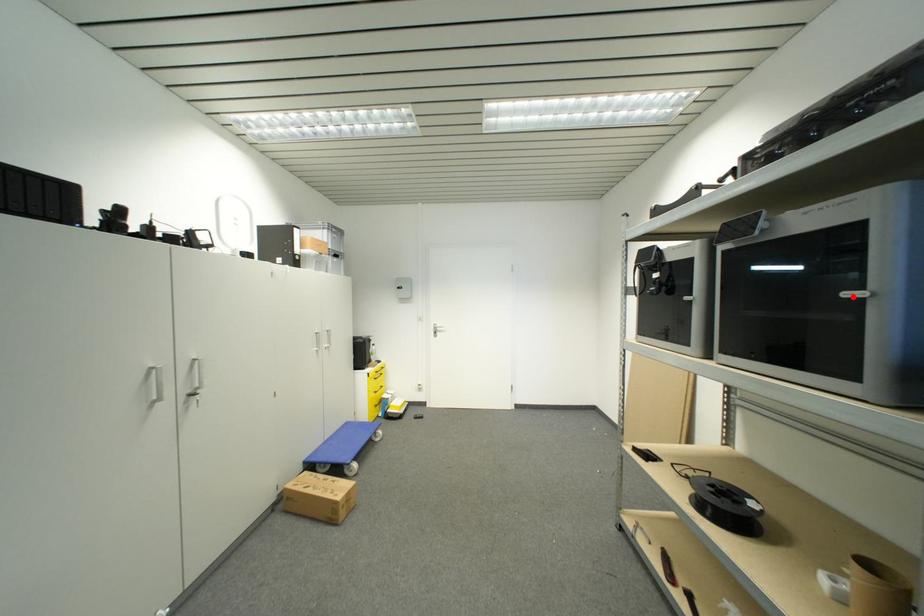
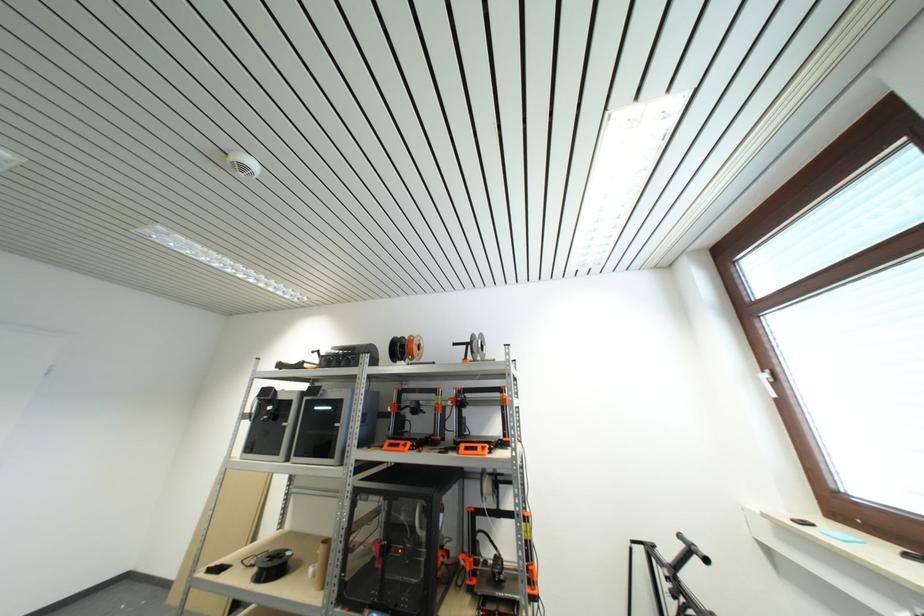
Question: I am providing you with two images of the same scene from different viewpoints. A red point is marked on the first image. At the location where the point appears in image 1, is it still visible in image 2?

Choices:
 (A) Yes
 (B) No

Answer: (A)